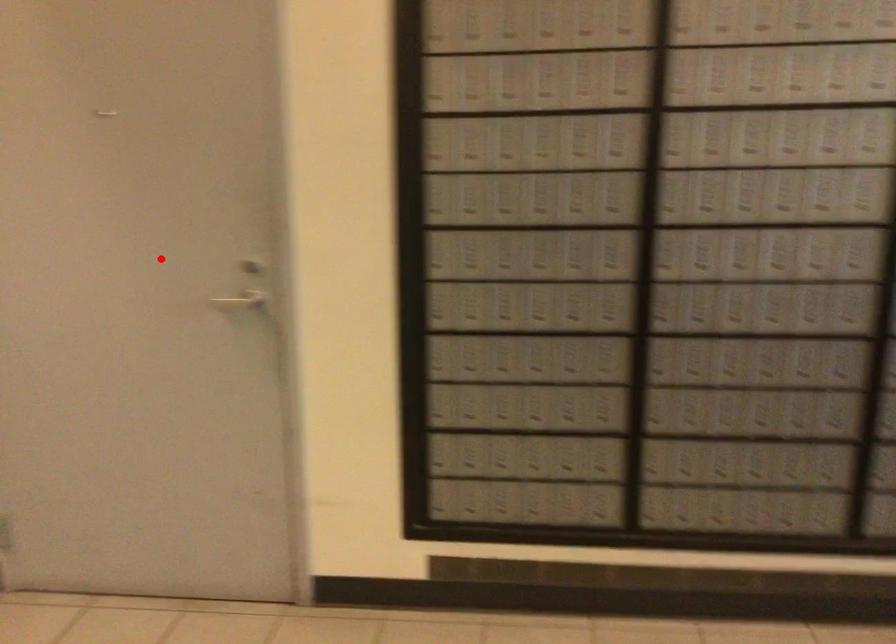
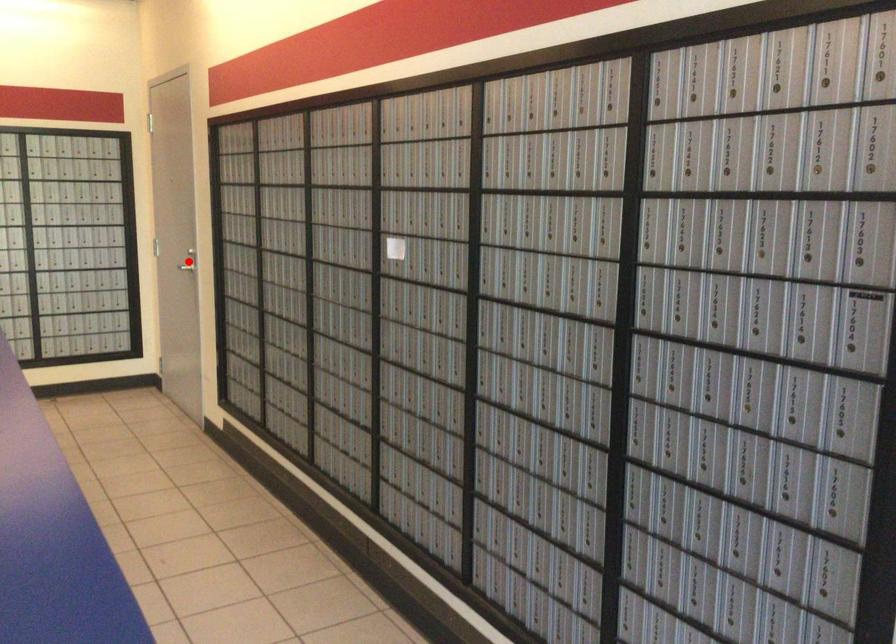
I am providing you with two images of the same scene from different viewpoints. A red point is marked on the first image and another point is marked on the second image. Do the highlighted points in image1 and image2 indicate the same real-world spot?

No